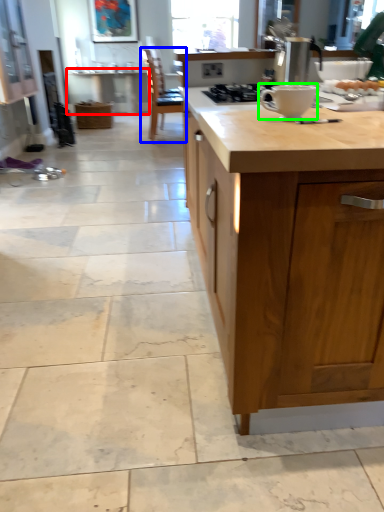
Question: Considering the real-world distances, which object is closest to table (highlighted by a red box)? chair (highlighted by a blue box) or coffee cup (highlighted by a green box).

Choices:
 (A) chair
 (B) coffee cup

Answer: (A)